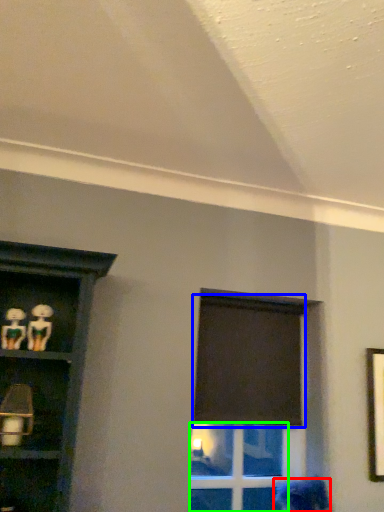
Question: Based on their relative distances, which object is farther from woman (highlighted by a red box)? Choose from curtain (highlighted by a blue box) and glass door (highlighted by a green box).

Choices:
 (A) curtain
 (B) glass door

Answer: (B)